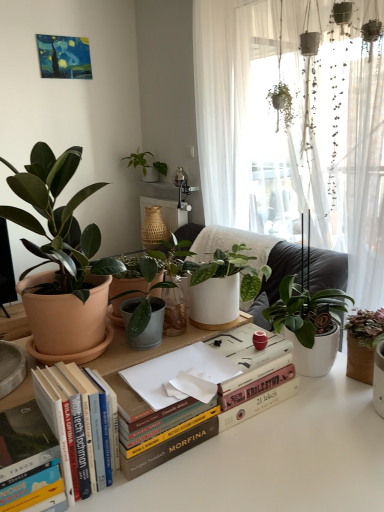
Question: Is green matte plant at right, the third houseplant from the top, inside or outside of green matte plant at upper center, marked as the 3th houseplant in a bottom-to-top arrangement?

Choices:
 (A) inside
 (B) outside

Answer: (B)

Question: In the image, is green matte plant at right, positioned as the 1th houseplant in right-to-left order, on the left side or the right side of green matte plant at upper center, marked as the 3th houseplant in a bottom-to-top arrangement?

Choices:
 (A) right
 (B) left

Answer: (A)

Question: Estimate the real-world distances between objects in this image. Which object is closer to the matte terracotta pot at left, which is counted as the 2th houseplant, starting from the top?

Choices:
 (A) hardcover book at lower left, the second paperback book viewed from the top
 (B) green matte plant at right, positioned as the 1th houseplant in right-to-left order
 (C) white paper at center, marked as the 1th paperback book in a top-to-bottom arrangement
 (D) hardcover books at center
 (E) green matte plant at upper center, the 3th houseplant viewed from the right

Answer: (D)

Question: Which object is the closest to the hardcover books at center?

Choices:
 (A) matte terracotta pot at left, the third houseplant when ordered from back to front
 (B) green matte plant at upper center, which is counted as the first houseplant, starting from the back
 (C) hardcover book at lower left, which is the 1th paperback book in left-to-right order
 (D) green matte plant at right, positioned as the 1th houseplant in right-to-left order
 (E) white paper at center, which appears as the 1th paperback book when viewed from the right

Answer: (C)